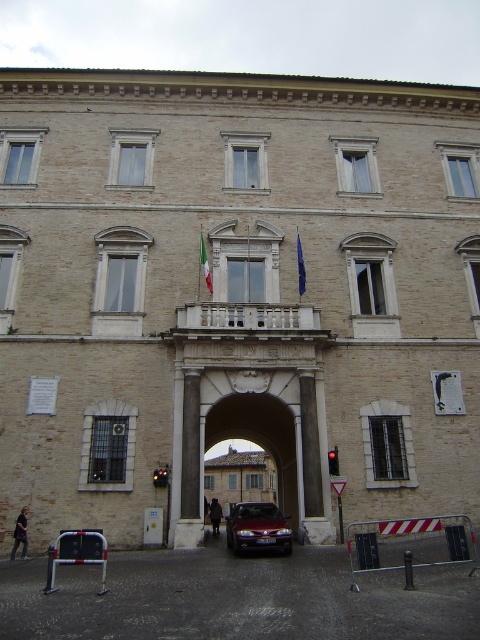
You are a visitor standing in front of the historic building and notice two flags at the central balcony. Which flag has a greater width between the blue fabric flag at center and the green fabric flag at center?

The blue fabric flag at center has a greater width than the green fabric flag at center according to the description.

You are standing in front of the historic building and see the smooth stone archway at center and the dark brown leather coat at center. Which object is positioned to the left of the other?

The dark brown leather coat at center is to the left of the smooth stone archway at center.

You are standing in front of the historic building and want to take a photo. There are two points of interest marked on your map at coordinates point [299,268] and point [205,272]. Which point is closer to you so that you can capture it clearly without moving your position?

Point [205,272] is closer to you than point [299,268], so you can capture it clearly without moving your position.